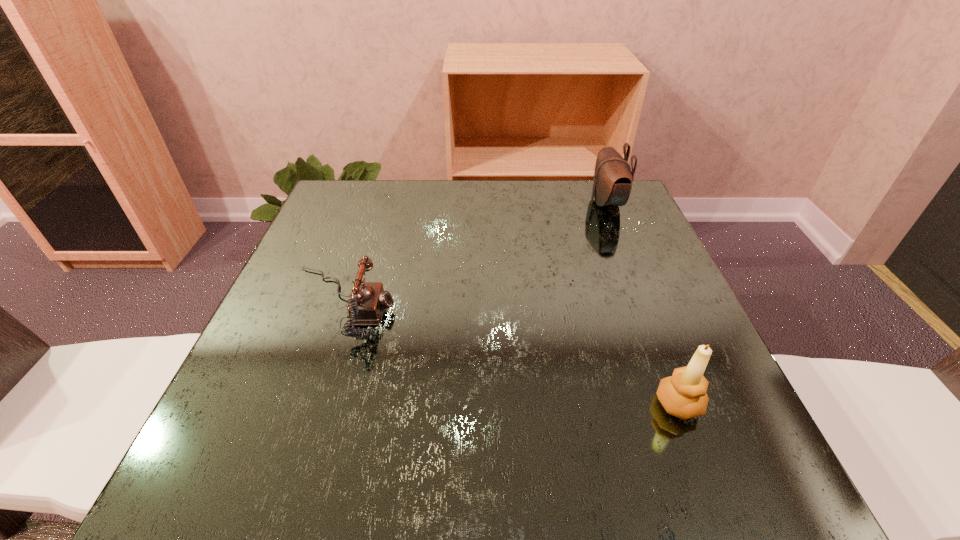
Find the location of a particular element. This screenshot has width=960, height=540. free area in between the nearest object and the farthest object is located at coordinates (642, 303).

At what (x,y) coordinates should I click in order to perform the action: click on vacant space in between the telephone and the pouch. Please return your answer as a coordinate pair (x, y). The width and height of the screenshot is (960, 540). Looking at the image, I should click on (473, 253).

The width and height of the screenshot is (960, 540). I want to click on blank region between the candle_holder and the pouch, so click(x=642, y=303).

Find the location of a particular element. unoccupied area between the shortest object and the candle_holder is located at coordinates (510, 354).

The image size is (960, 540). I want to click on vacant area that lies between the shortest object and the candle_holder, so click(510, 354).

You are a GUI agent. You are given a task and a screenshot of the screen. Output one action in this format:
    pyautogui.click(x=<x>, y=<y>)
    Task: Click on the free space between the nearest object and the second nearest object
    The image size is (960, 540).
    Given the screenshot: What is the action you would take?
    pyautogui.click(x=510, y=354)

In order to click on free space between the farthest object and the leftmost object in this screenshot , I will do `click(473, 253)`.

At what (x,y) coordinates should I click in order to perform the action: click on free space between the candle_holder and the shortest object. Please return your answer as a coordinate pair (x, y). The height and width of the screenshot is (540, 960). Looking at the image, I should click on (510, 354).

At what (x,y) coordinates should I click in order to perform the action: click on vacant point located between the telephone and the farthest object. Please return your answer as a coordinate pair (x, y). Looking at the image, I should click on (473, 253).

At what (x,y) coordinates should I click in order to perform the action: click on free point between the candle_holder and the farthest object. Please return your answer as a coordinate pair (x, y). Looking at the image, I should click on (642, 303).